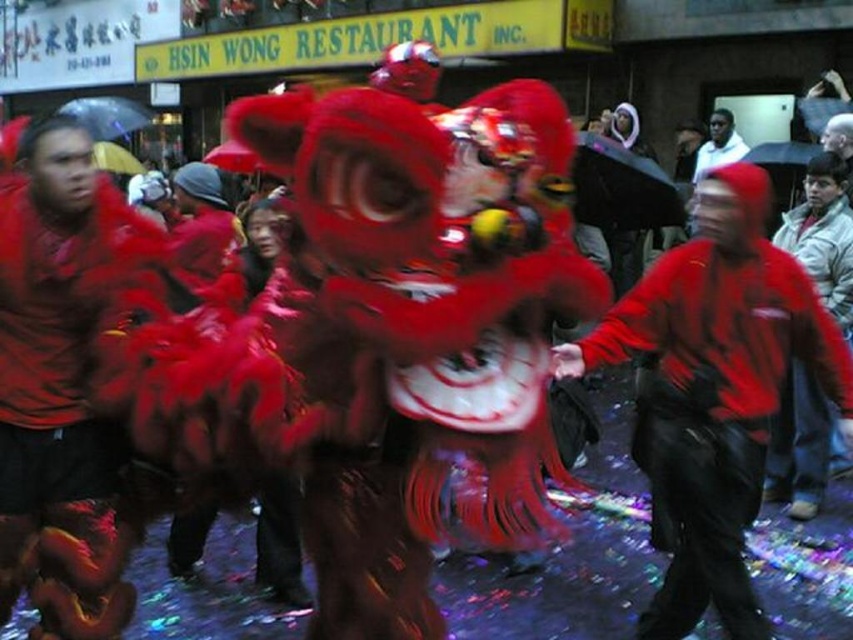
Question: Is velvet red lion at center positioned at the back of red matte jacket at right?

Choices:
 (A) yes
 (B) no

Answer: (B)

Question: Which is farther from the matte red jacket at center?

Choices:
 (A) velvet red lion at center
 (B) white cotton hoodie at upper center
 (C) red matte jacket at right

Answer: (B)

Question: Which point is farther to the camera?

Choices:
 (A) red matte jacket at right
 (B) velvet red lion at center
 (C) matte red jacket at center

Answer: (A)

Question: Is matte red jacket at center to the left of red matte jacket at right from the viewer's perspective?

Choices:
 (A) no
 (B) yes

Answer: (B)

Question: Can you confirm if velvet red lion at center is positioned to the left of red matte jacket at right?

Choices:
 (A) no
 (B) yes

Answer: (B)

Question: Which point is farther to the camera?

Choices:
 (A) velvet red lion at center
 (B) matte red jacket at center
 (C) white cotton hoodie at upper center
 (D) red matte jacket at right

Answer: (C)